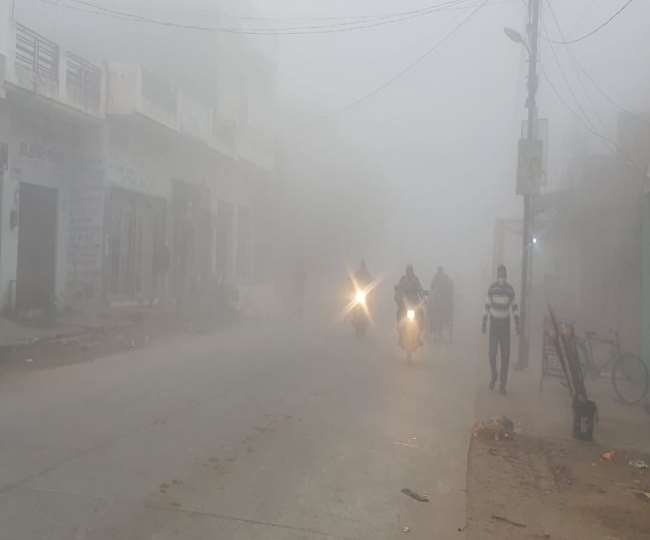
The height and width of the screenshot is (540, 650). I want to click on doorway, so click(x=40, y=247), click(x=190, y=253).